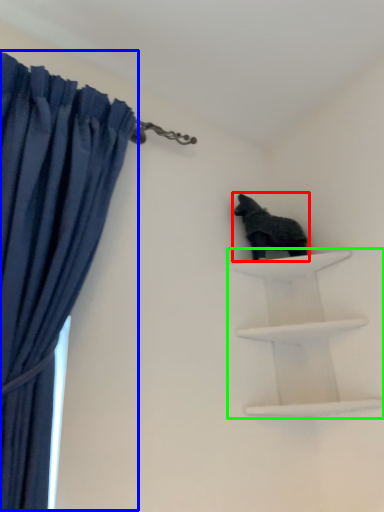
Question: Based on their relative distances, which object is nearer to animal (highlighted by a red box)? Choose from curtain (highlighted by a blue box) and shelf (highlighted by a green box).

Choices:
 (A) curtain
 (B) shelf

Answer: (B)